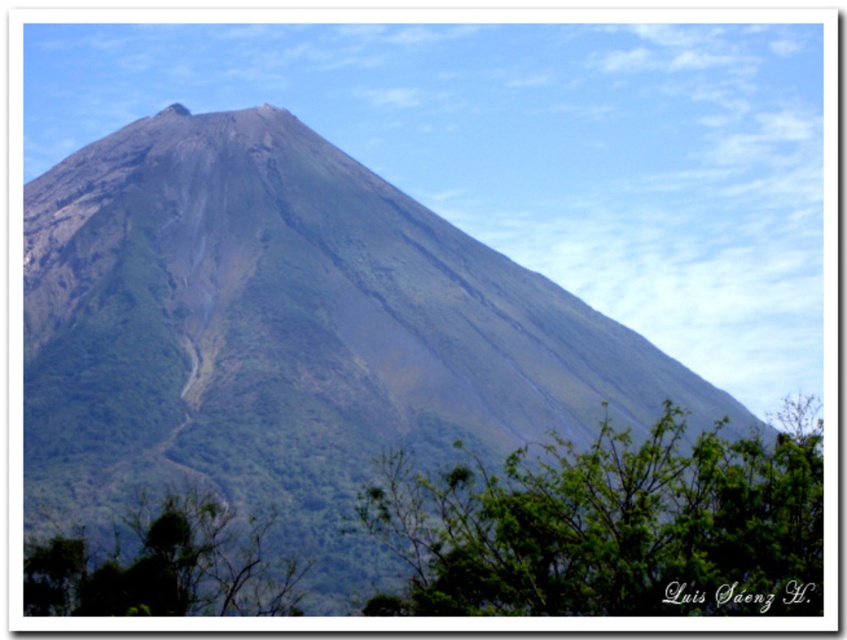
You are a hiker planning to reach the summit of the green rock mountain at center. According to the map, the point with coordinates point (291, 333) is the highest point. If you start from the base at the bottom of the image, which direction should you head to reach the highest point?

The highest point of the green rock mountain at center is located at coordinates point (291, 333), so you should head towards the center of the mountain to reach the summit.

Looking at this image, you are a hiker planning to take a photo of the green rock mountain at center and the green leafy tree at lower center. Which object should you frame wider in your camera to capture its full width?

The green rock mountain at center should be framed wider because its width surpasses that of the green leafy tree at lower center.

You are a hiker standing at the base of the volcano and want to reach the peak. You notice two points marked on your map corresponding to coordinates point (713, 433) and point (54, 592). Which point is closer to you as you start your hike?

Point (713, 433) is further to the viewer than point (54, 592). Therefore, point (54, 592) is closer to you as you start your hike.